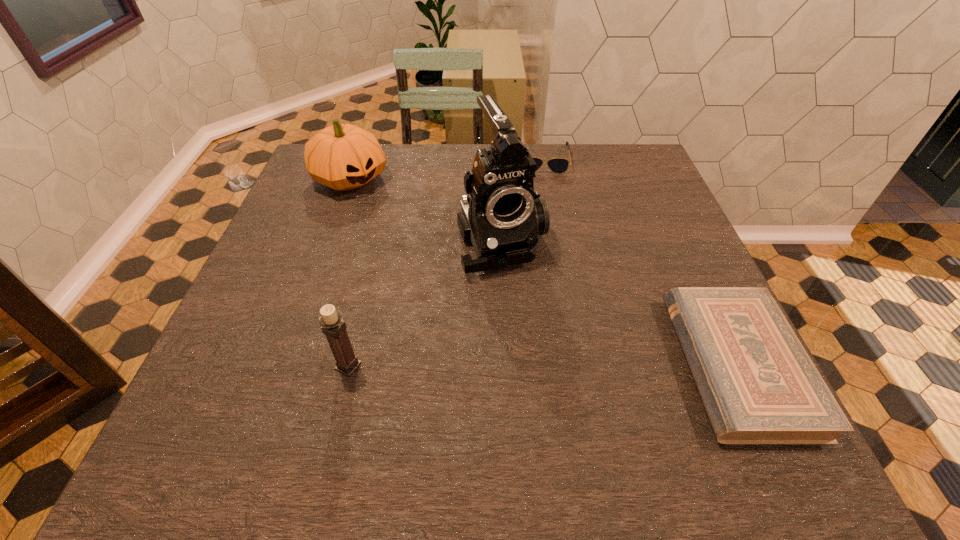
You are a GUI agent. You are given a task and a screenshot of the screen. Output one action in this format:
    pyautogui.click(x=<x>, y=<y>)
    Task: Click on the object that ranks as the fourth closest to the rightmost object
    This screenshot has height=540, width=960.
    Given the screenshot: What is the action you would take?
    pyautogui.click(x=343, y=157)

Image resolution: width=960 pixels, height=540 pixels. In order to click on free space that satisfies the following two spatial constraints: 1. on the back side of the Bible; 2. on the spine side of the candle holder in this screenshot , I will do `click(348, 364)`.

Identify the location of vacant position in the image that satisfies the following two spatial constraints: 1. on the back side of the candle holder; 2. on the left side of the sunglasses. (398, 158).

What are the coordinates of `vacant space that satisfies the following two spatial constraints: 1. on the front side of the sunglasses; 2. on the spine side of the rightmost object` in the screenshot? It's located at (582, 364).

At what (x,y) coordinates should I click in order to perform the action: click on vacant area that satisfies the following two spatial constraints: 1. on the back side of the rightmost object; 2. on the spine side of the candle holder. Please return your answer as a coordinate pair (x, y). The image size is (960, 540). Looking at the image, I should click on (348, 364).

Locate an element on the screen. Image resolution: width=960 pixels, height=540 pixels. vacant space that satisfies the following two spatial constraints: 1. on the back side of the Bible; 2. on the spine side of the candle holder is located at coordinates (348, 364).